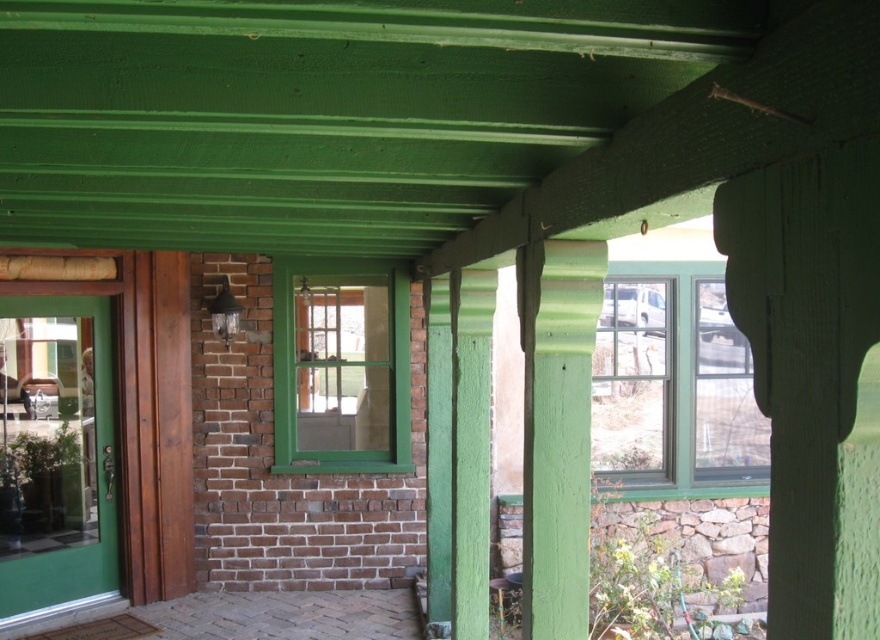
Question: Estimate the real-world distances between objects in this image. Which object is farther from the green painted wood window at center?

Choices:
 (A) green painted wood at center
 (B) green painted wood window at upper right

Answer: (A)

Question: Which point appears closest to the camera in this image?

Choices:
 (A) (566, 288)
 (B) (726, 472)

Answer: (A)

Question: Can you confirm if clear glass door at left is positioned below green painted wood window at upper right?

Choices:
 (A) no
 (B) yes

Answer: (B)

Question: Among these points, which one is nearest to the camera?

Choices:
 (A) (768, 449)
 (B) (568, 326)
 (C) (272, 285)
 (D) (48, 337)

Answer: (B)

Question: Is green painted wood window at upper right thinner than green painted wood window at center?

Choices:
 (A) yes
 (B) no

Answer: (B)

Question: Does clear glass door at left appear over green painted wood window at center?

Choices:
 (A) yes
 (B) no

Answer: (B)